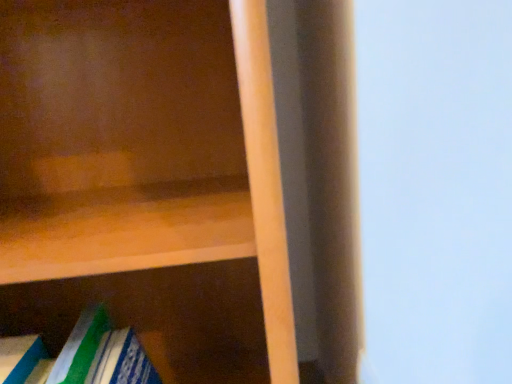
This screenshot has height=384, width=512. Describe the element at coordinates (185, 181) in the screenshot. I see `matte wood bookcase at lower left` at that location.

This screenshot has height=384, width=512. Identify the location of matte wood bookcase at lower left. (185, 181).

Where is `matte wood bookcase at lower left`? The height and width of the screenshot is (384, 512). matte wood bookcase at lower left is located at coordinates (185, 181).